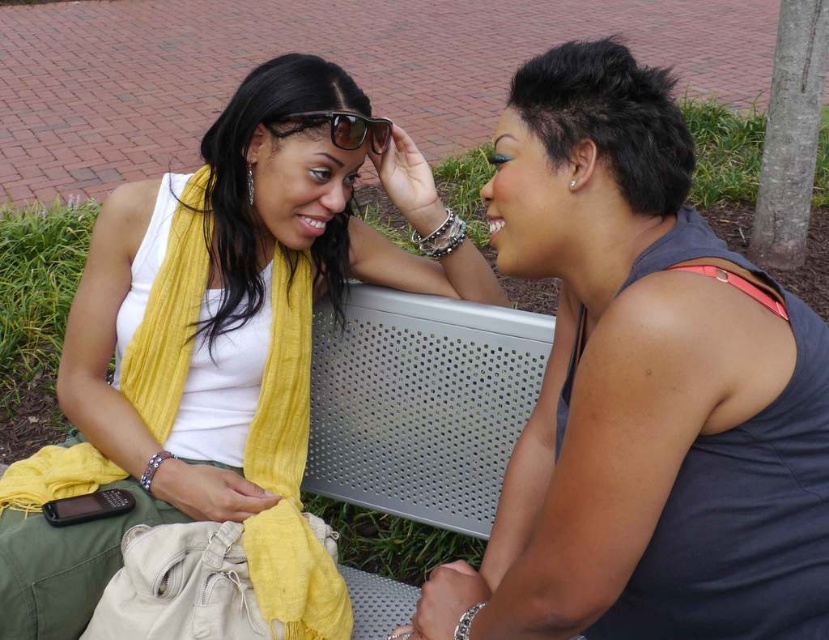
Is dark blue tank top at center below white matte tank top at upper left?

No, dark blue tank top at center is not below white matte tank top at upper left.

Can you confirm if dark blue tank top at center is thinner than white matte tank top at upper left?

Indeed, dark blue tank top at center has a lesser width compared to white matte tank top at upper left.

Measure the distance between point (606, 448) and camera.

The distance of point (606, 448) from camera is 33.91 inches.

Where is `dark blue tank top at center`? dark blue tank top at center is located at coordinates (642, 392).

Between dark blue tank top at center and sunglasses at center, which one is positioned higher?

sunglasses at center

Between dark blue tank top at center and sunglasses at center, which one appears on the left side from the viewer's perspective?

sunglasses at center

Who is more distant from viewer, (699, 544) or (374, 125)?

The point (374, 125) is behind.

Image resolution: width=829 pixels, height=640 pixels. What are the coordinates of `dark blue tank top at center` in the screenshot? It's located at (642, 392).

Who is taller, white matte tank top at upper left or sunglasses at center?

white matte tank top at upper left is taller.

Between white matte tank top at upper left and sunglasses at center, which one appears on the left side from the viewer's perspective?

From the viewer's perspective, white matte tank top at upper left appears more on the left side.

Is point (331, 256) less distant than point (274, 122)?

No, (331, 256) is further to viewer.

You are a GUI agent. You are given a task and a screenshot of the screen. Output one action in this format:
    pyautogui.click(x=<x>, y=<y>)
    Task: Click on the white matte tank top at upper left
    
    Given the screenshot: What is the action you would take?
    pyautogui.click(x=217, y=355)